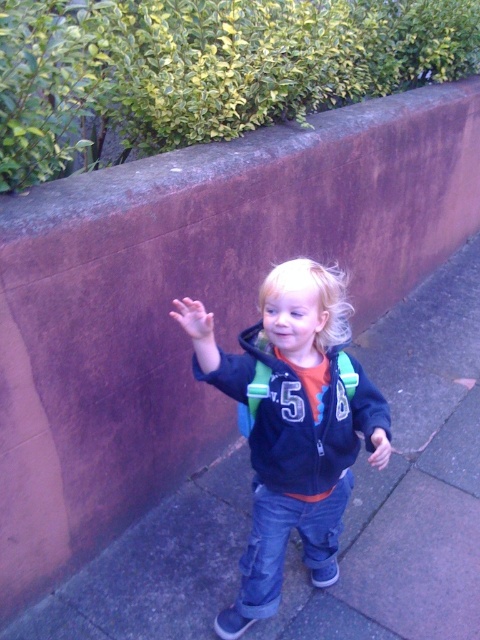
You are a painter who wants to paint the matte black jacket at center and the green leafy hedge at upper left. Which object should you focus on first if you want to paint the larger one first?

The green leafy hedge at upper left is larger in size than the matte black jacket at center, so you should focus on painting the green leafy hedge at upper left first.

From the picture: You are a delivery robot positioned at the green leafy hedge at upper left and need to reach the gray concrete pavement at center. Which direction should you move to get there?

The gray concrete pavement at center is to the right of the green leafy hedge at upper left, so you should move to the right to reach it.